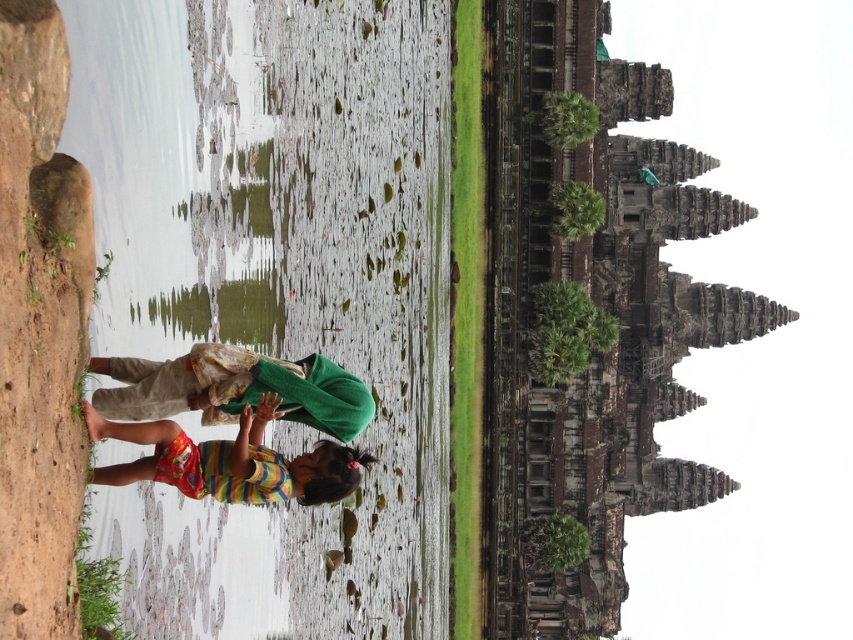
You are a photographer trying to capture a photo of the rusty stone temple at upper right and the brown rough rock at left. Based on their positions, which object should you place on the right side of your camera frame to ensure both are visible?

The rusty stone temple at upper right is positioned on the right side of brown rough rock at left. Therefore, to ensure both are visible in the photo, you should place the rusty stone temple at upper right on the right side of your camera frame.